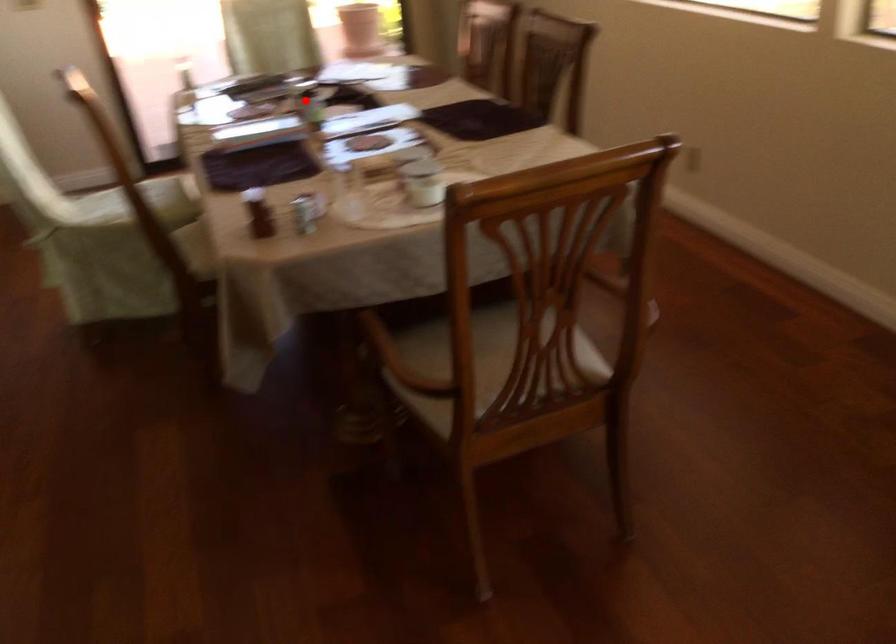
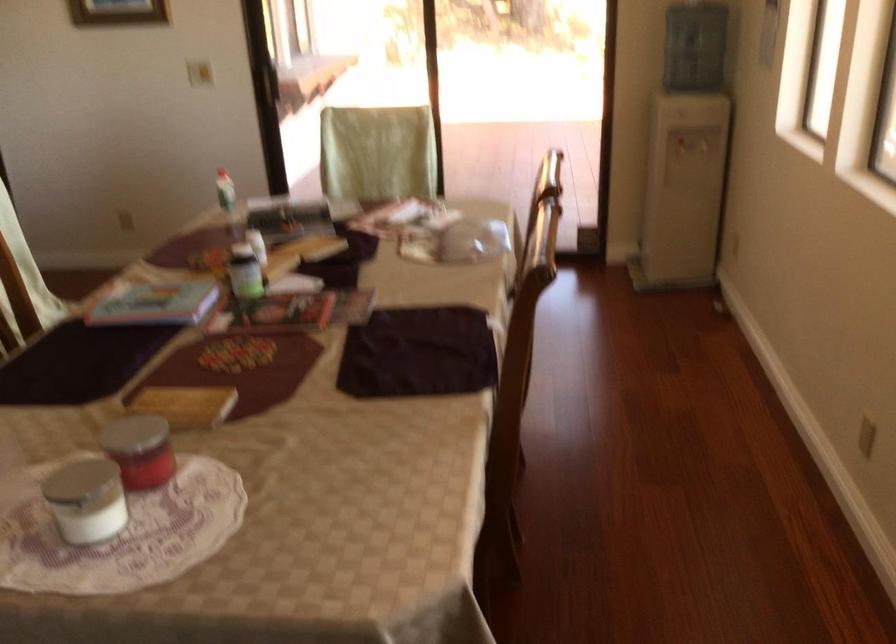
Question: I am providing you with two images of the same scene from different viewpoints. In image1, a red point is highlighted. Considering the same 3D point in image2, which of the following is correct?

Choices:
 (A) It is closer
 (B) It is farther

Answer: (A)